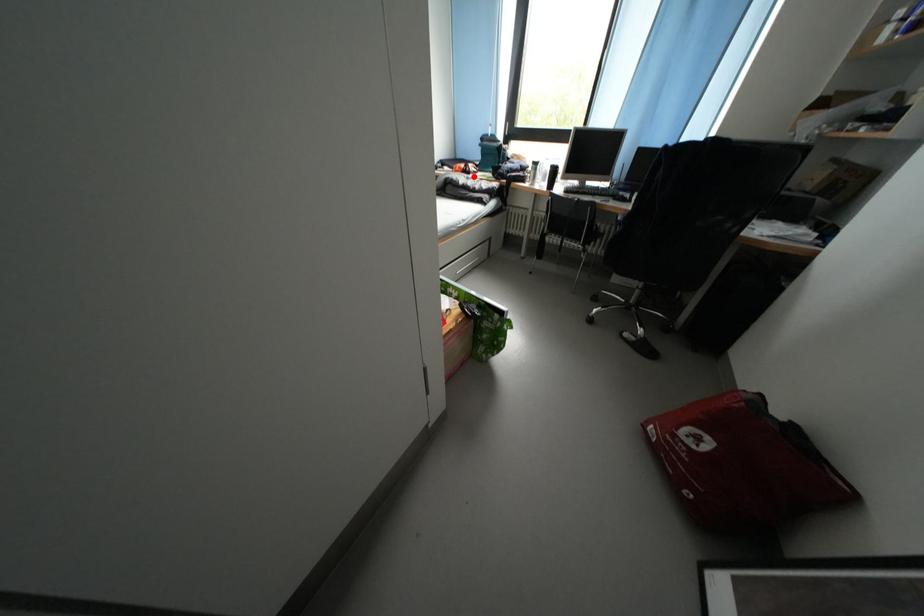
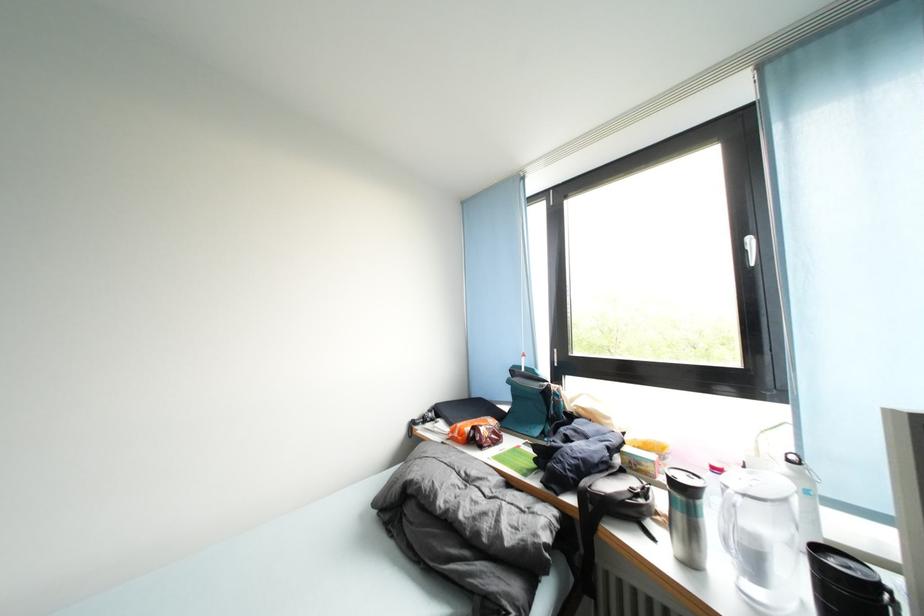
Question: A red point is marked in image1. In image2, is the corresponding 3D point closer to the camera or farther? Reply with the corresponding letter.

Choices:
 (A) The corresponding 3D point is closer.
 (B) The corresponding 3D point is farther.

Answer: (B)